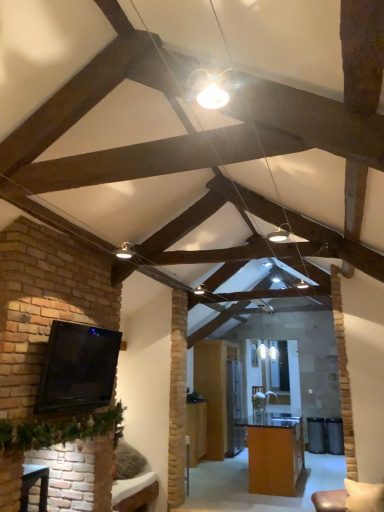
Question: Considering the relative sizes of wooden table at center, which is the first table from left to right, and orange glossy table at center, marked as the 2th table in a left-to-right arrangement, in the image provided, is wooden table at center, which is the first table from left to right, wider than orange glossy table at center, marked as the 2th table in a left-to-right arrangement,?

Choices:
 (A) no
 (B) yes

Answer: (A)

Question: Is wooden table at center, which ranks as the second table in right-to-left order, positioned in front of orange glossy table at center, marked as the 2th table in a left-to-right arrangement?

Choices:
 (A) yes
 (B) no

Answer: (B)

Question: Does wooden table at center, which is the first table from left to right, have a greater height compared to orange glossy table at center, positioned as the 1th table in right-to-left order?

Choices:
 (A) yes
 (B) no

Answer: (A)

Question: From the image's perspective, is wooden table at center, which ranks as the second table in right-to-left order, on orange glossy table at center, marked as the 2th table in a left-to-right arrangement?

Choices:
 (A) no
 (B) yes

Answer: (A)

Question: Does wooden table at center, which ranks as the second table in right-to-left order, turn towards orange glossy table at center, positioned as the 1th table in right-to-left order?

Choices:
 (A) no
 (B) yes

Answer: (B)

Question: From the image's perspective, is brick fireplace at lower left above or below orange glossy table at center, marked as the 2th table in a left-to-right arrangement?

Choices:
 (A) above
 (B) below

Answer: (A)

Question: Choose the correct answer: Is brick fireplace at lower left inside orange glossy table at center, marked as the 2th table in a left-to-right arrangement, or outside it?

Choices:
 (A) outside
 (B) inside

Answer: (A)

Question: Would you say brick fireplace at lower left is to the left or to the right of orange glossy table at center, positioned as the 1th table in right-to-left order, in the picture?

Choices:
 (A) left
 (B) right

Answer: (A)

Question: From their relative heights in the image, would you say brick fireplace at lower left is taller or shorter than orange glossy table at center, positioned as the 1th table in right-to-left order?

Choices:
 (A) short
 (B) tall

Answer: (A)

Question: From the image's perspective, relative to matte white bulb at center, is brick fireplace at lower left above or below?

Choices:
 (A) below
 (B) above

Answer: (A)

Question: Is point (41, 496) positioned closer to the camera than point (188, 86)?

Choices:
 (A) farther
 (B) closer

Answer: (A)

Question: Is brick fireplace at lower left inside the boundaries of matte white bulb at center, or outside?

Choices:
 (A) inside
 (B) outside

Answer: (B)

Question: Looking at the image, does brick fireplace at lower left seem bigger or smaller compared to matte white bulb at center?

Choices:
 (A) big
 (B) small

Answer: (A)

Question: From the image's perspective, relative to brick fireplace at lower left, is matte white bulb at center above or below?

Choices:
 (A) below
 (B) above

Answer: (B)

Question: Considering the positions of matte white bulb at center and brick fireplace at lower left in the image, is matte white bulb at center wider or thinner than brick fireplace at lower left?

Choices:
 (A) wide
 (B) thin

Answer: (B)